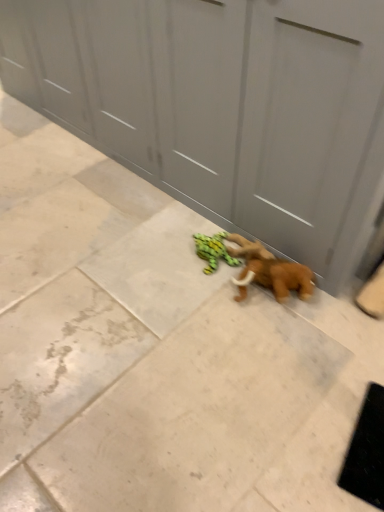
The width and height of the screenshot is (384, 512). Find the location of `free space to the right of brown plush elephant at lower center`. free space to the right of brown plush elephant at lower center is located at coordinates (347, 315).